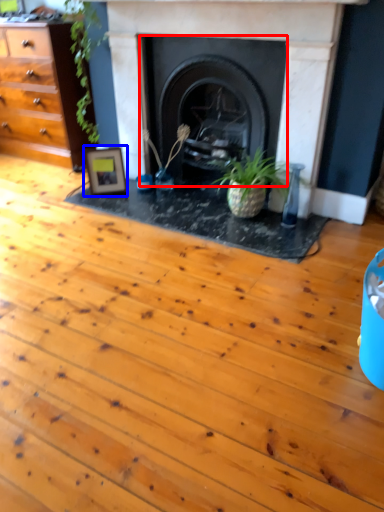
Question: Which object is further to the camera taking this photo, fireplace (highlighted by a red box) or picture frame (highlighted by a blue box)?

Choices:
 (A) fireplace
 (B) picture frame

Answer: (B)